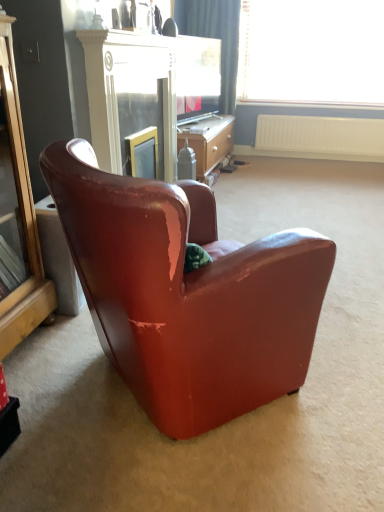
What do you see at coordinates (141, 104) in the screenshot? I see `matte glass screen door at upper center` at bounding box center [141, 104].

Measure the distance between point (293, 250) and camera.

Point (293, 250) is 3.82 feet from camera.

The width and height of the screenshot is (384, 512). What are the coordinates of `leather armchair at center` in the screenshot? It's located at (187, 294).

Find the location of `white plastic radiator at upper right`. white plastic radiator at upper right is located at coordinates (320, 137).

Identify the location of gold mirrored cabinet at left. (17, 217).

In order to click on matte glass screen door at upper center in this screenshot , I will do `click(141, 104)`.

Is leather armchair at center to the left of gold mirrored cabinet at left from the viewer's perspective?

No.

From the image's perspective, is leather armchair at center on gold mirrored cabinet at left?

No, from the image's perspective, leather armchair at center is not on top of gold mirrored cabinet at left.

Which of these two, leather armchair at center or gold mirrored cabinet at left, is smaller?

With smaller size is gold mirrored cabinet at left.

Is the position of matte glass screen door at upper center more distant than that of transparent glass window at upper center?

No, matte glass screen door at upper center is in front of transparent glass window at upper center.

Where is `screen door below the transparent glass window at upper center (from the image's perspective)`? This screenshot has height=512, width=384. screen door below the transparent glass window at upper center (from the image's perspective) is located at coordinates (141, 104).

How distant is matte glass screen door at upper center from transparent glass window at upper center?

They are 8.63 feet apart.

Considering the sizes of matte glass screen door at upper center and transparent glass window at upper center in the image, is matte glass screen door at upper center taller or shorter than transparent glass window at upper center?

Considering their sizes, matte glass screen door at upper center has less height than transparent glass window at upper center.

Which of these two, leather armchair at center or white plastic radiator at upper right, is thinner?

Thinner between the two is white plastic radiator at upper right.

Based on their positions, is leather armchair at center located to the left or right of white plastic radiator at upper right?

Based on their positions, leather armchair at center is located to the left of white plastic radiator at upper right.

There is a white plastic radiator at upper right. Identify the location of chair above it (from a real-world perspective). The height and width of the screenshot is (512, 384). (187, 294).

Considering the positions of points (91, 289) and (369, 121), is point (91, 289) closer to camera compared to point (369, 121)?

Yes, it is.

Is point (216, 66) positioned behind point (63, 175)?

Yes.

Is leather armchair at center located within matte black television at center?

Definitely not — leather armchair at center is not inside matte black television at center.

Between matte black television at center and leather armchair at center, which one has less height?

matte black television at center.

At what (x,y) coordinates should I click in order to perform the action: click on window above the matte black television at center (from a real-world perspective). Please return your answer as a coordinate pair (x, y). Looking at the image, I should click on (312, 52).

Which is more to the right, transparent glass window at upper center or matte black television at center?

From the viewer's perspective, transparent glass window at upper center appears more on the right side.

Is transparent glass window at upper center facing away from matte black television at center?

That's not correct — transparent glass window at upper center is not looking away from matte black television at center.

Are transparent glass window at upper center and matte black television at center far apart?

Yes, transparent glass window at upper center is far from matte black television at center.

Between point (372, 127) and point (180, 117), which one is positioned in front?

Point (180, 117)

Based on the photo, which of these two, white plastic radiator at upper right or matte black television at center, is wider?

With larger width is matte black television at center.

Is white plastic radiator at upper right positioned before matte black television at center?

No.

What's the angular difference between wooden desk at center and transparent glass window at upper center's facing directions?

There is a 89.9-degree angle between the facing directions of wooden desk at center and transparent glass window at upper center.

Is point (192, 140) less distant than point (303, 102)?

Yes, it is.

From the image's perspective, is wooden desk at center located above transparent glass window at upper center?

No, from the image's perspective, wooden desk at center is not over transparent glass window at upper center.

Who is shorter, wooden desk at center or transparent glass window at upper center?

Standing shorter between the two is wooden desk at center.

Find the location of `cabinetry above the leather armchair at center (from the image's perspective)`. cabinetry above the leather armchair at center (from the image's perspective) is located at coordinates (17, 217).

Where is `window located behind the matte glass screen door at upper center`? window located behind the matte glass screen door at upper center is located at coordinates (312, 52).

From the image, which object appears to be nearer to matte black television at center, transparent glass window at upper center or white plastic radiator at upper right?

transparent glass window at upper center.

From the image, which object appears to be farther from matte glass screen door at upper center, white plastic radiator at upper right or transparent glass window at upper center?

transparent glass window at upper center is positioned further to the anchor matte glass screen door at upper center.

When comparing their distances from wooden desk at center, does transparent glass window at upper center or gold mirrored cabinet at left seem closer?

The object closer to wooden desk at center is transparent glass window at upper center.

From the image, which object appears to be farther from white plastic radiator at upper right, leather armchair at center or gold mirrored cabinet at left?

leather armchair at center is further to white plastic radiator at upper right.

Considering their positions, is white plastic radiator at upper right positioned further to matte glass screen door at upper center than gold mirrored cabinet at left?

white plastic radiator at upper right.

Looking at the image, which one is located closer to leather armchair at center, transparent glass window at upper center or matte glass screen door at upper center?

Among the two, matte glass screen door at upper center is located nearer to leather armchair at center.

Looking at the image, which one is located closer to gold mirrored cabinet at left, leather armchair at center or white plastic radiator at upper right?

Among the two, leather armchair at center is located nearer to gold mirrored cabinet at left.

Considering their positions, is matte black television at center positioned further to gold mirrored cabinet at left than white plastic radiator at upper right?

white plastic radiator at upper right is positioned further to the anchor gold mirrored cabinet at left.

What are the coordinates of `television between leather armchair at center and transparent glass window at upper center in the front-back direction` in the screenshot? It's located at (197, 77).

Image resolution: width=384 pixels, height=512 pixels. What are the coordinates of `television located between leather armchair at center and wooden desk at center in the depth direction` in the screenshot? It's located at (197, 77).

The image size is (384, 512). What are the coordinates of `cabinetry between leather armchair at center and wooden desk at center in the front-back direction` in the screenshot? It's located at (17, 217).

At what (x,y) coordinates should I click in order to perform the action: click on desk between matte glass screen door at upper center and white plastic radiator at upper right in the front-back direction. Please return your answer as a coordinate pair (x, y). The width and height of the screenshot is (384, 512). Looking at the image, I should click on (208, 142).